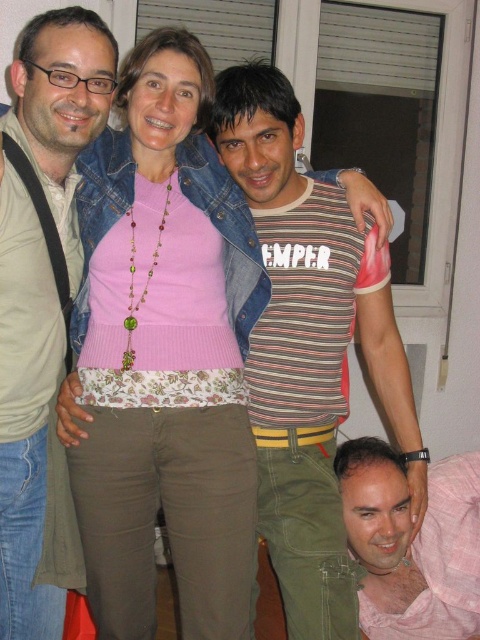
Question: Is pink knitted sweater at center to the left of striped cotton shirt at center from the viewer's perspective?

Choices:
 (A) yes
 (B) no

Answer: (A)

Question: Estimate the real-world distances between objects in this image. Which object is closer to the pink fabric shirt at lower right?

Choices:
 (A) matte black shirt at left
 (B) striped cotton shirt at center
 (C) pink knitted sweater at center

Answer: (B)

Question: Can you confirm if matte black shirt at left is thinner than pink fabric shirt at lower right?

Choices:
 (A) yes
 (B) no

Answer: (A)

Question: Which object is farther from the camera taking this photo?

Choices:
 (A) striped cotton shirt at center
 (B) matte black shirt at left

Answer: (A)

Question: Does matte black shirt at left appear on the left side of pink fabric shirt at lower right?

Choices:
 (A) yes
 (B) no

Answer: (A)

Question: Which object is positioned closest to the matte black shirt at left?

Choices:
 (A) striped cotton shirt at center
 (B) pink fabric shirt at lower right
 (C) pink knitted sweater at center

Answer: (C)